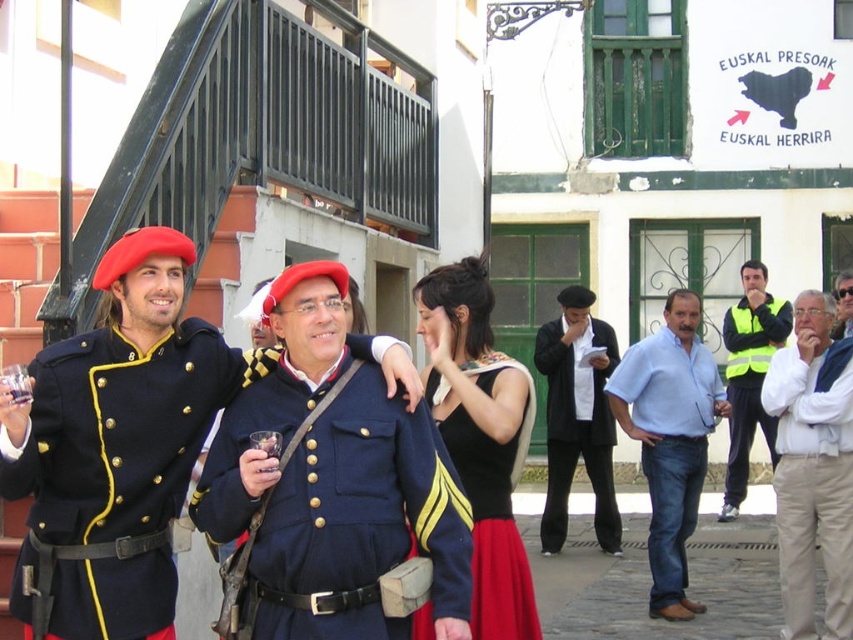
You are a photographer at an event and need to capture a clear photo of both the light blue cotton shirt at center and the black matte suit at center. Based on their positions, which one should you focus on first to ensure both are in focus?

You should focus on the black matte suit at center first because the light blue cotton shirt at center is in front of it, so adjusting focus from the front to the back will help both be in focus.

In the scene described, there are two individuals wearing the blue cotton uniform at center and the light blue cotton shirt at center. Which one is positioned to the left?

The blue cotton uniform at center is to the left of the light blue cotton shirt at center.

You are standing at the origin point in the image. Which of the two points, point (212, 385) or point (525, 428), is closer to you?

Point (212, 385) is closer to you because it is in front of point (525, 428).